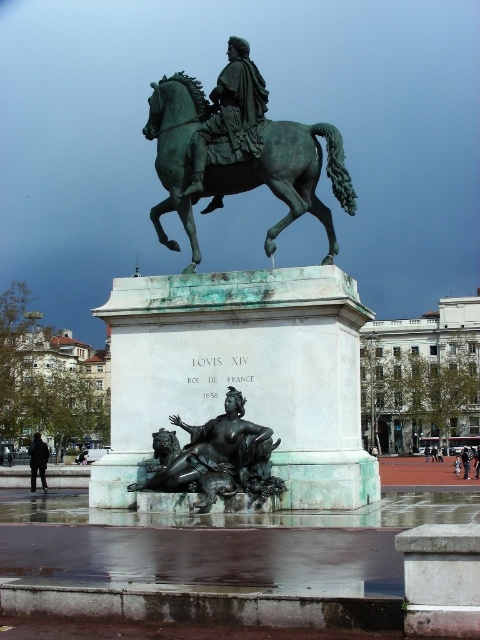
Does green patina bronze horse at center appear under black matte jacket at lower left?

No, green patina bronze horse at center is not below black matte jacket at lower left.

Is green patina bronze horse at center smaller than black matte jacket at lower left?

Correct, green patina bronze horse at center occupies less space than black matte jacket at lower left.

Between point (294, 284) and point (31, 481), which one is positioned behind?

Point (31, 481)

At what (x,y) coordinates should I click in order to perform the action: click on green patina bronze horse at center. Please return your answer as a coordinate pair (x, y). Looking at the image, I should click on (238, 317).

Is green patina bronze horse at center to the left of bronze statue at lower center from the viewer's perspective?

Yes, green patina bronze horse at center is to the left of bronze statue at lower center.

Which is in front, point (192, 116) or point (223, 467)?

Point (223, 467) is more forward.

I want to click on green patina bronze horse at center, so click(238, 317).

Is green patina horse at center behind green patina statue at center?

No, green patina horse at center is closer to the viewer.

Is point (164, 147) less distant than point (227, 52)?

That is True.

Is point (268, 125) less distant than point (227, 125)?

No, it is behind (227, 125).

You are a GUI agent. You are given a task and a screenshot of the screen. Output one action in this format:
    pyautogui.click(x=<x>, y=<y>)
    Task: Click on the green patina horse at center
    
    Given the screenshot: What is the action you would take?
    pyautogui.click(x=240, y=164)